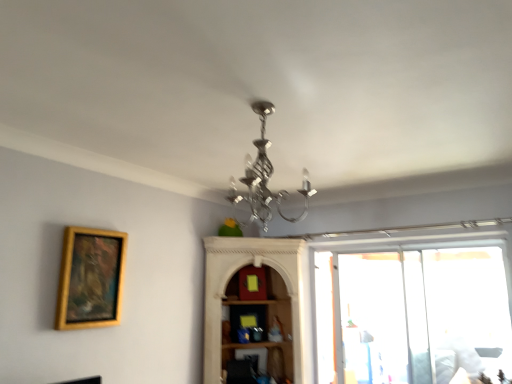
Question: Does transparent plastic screen door at right have a lesser height compared to gold wooden picture frame at left?

Choices:
 (A) no
 (B) yes

Answer: (A)

Question: From a real-world perspective, is transparent plastic screen door at right over gold wooden picture frame at left?

Choices:
 (A) yes
 (B) no

Answer: (B)

Question: Does transparent plastic screen door at right have a greater width compared to gold wooden picture frame at left?

Choices:
 (A) yes
 (B) no

Answer: (A)

Question: Does transparent plastic screen door at right come behind gold wooden picture frame at left?

Choices:
 (A) no
 (B) yes

Answer: (B)

Question: From the image's perspective, is transparent plastic screen door at right on top of gold wooden picture frame at left?

Choices:
 (A) no
 (B) yes

Answer: (A)

Question: Looking at the image, does silver metallic chandelier at center seem bigger or smaller compared to transparent plastic screen door at right?

Choices:
 (A) big
 (B) small

Answer: (B)

Question: From a real-world perspective, is silver metallic chandelier at center positioned above or below transparent plastic screen door at right?

Choices:
 (A) below
 (B) above

Answer: (B)

Question: From their relative heights in the image, would you say silver metallic chandelier at center is taller or shorter than transparent plastic screen door at right?

Choices:
 (A) short
 (B) tall

Answer: (A)

Question: Is point (267, 196) positioned closer to the camera than point (393, 379)?

Choices:
 (A) closer
 (B) farther

Answer: (A)

Question: In terms of height, does gold wooden picture frame at left look taller or shorter compared to silver metallic chandelier at center?

Choices:
 (A) short
 (B) tall

Answer: (B)

Question: Considering the positions of gold wooden picture frame at left and silver metallic chandelier at center in the image, is gold wooden picture frame at left bigger or smaller than silver metallic chandelier at center?

Choices:
 (A) small
 (B) big

Answer: (A)

Question: Considering the relative positions of gold wooden picture frame at left and silver metallic chandelier at center in the image provided, is gold wooden picture frame at left to the left or to the right of silver metallic chandelier at center?

Choices:
 (A) left
 (B) right

Answer: (A)

Question: In terms of width, does gold wooden picture frame at left look wider or thinner when compared to silver metallic chandelier at center?

Choices:
 (A) thin
 (B) wide

Answer: (A)

Question: From a real-world perspective, is silver metallic chandelier at center physically located above or below gold wooden picture frame at left?

Choices:
 (A) below
 (B) above

Answer: (B)

Question: Considering the relative positions of silver metallic chandelier at center and gold wooden picture frame at left in the image provided, is silver metallic chandelier at center to the left or to the right of gold wooden picture frame at left?

Choices:
 (A) left
 (B) right

Answer: (B)